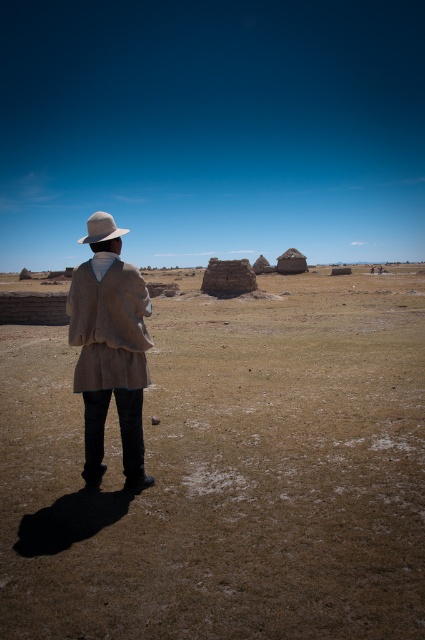
You are a photographer trying to capture the beige woolen poncho at center and the light beige felt fedora at back in a single frame. Based on their positions, which object should you focus on first to ensure both are in the shot?

The beige woolen poncho at center is positioned under the light beige felt fedora at back, so you should focus on the light beige felt fedora at back first to ensure both are in the shot.

You are navigating a drone over the landscape and need to drop a package at the point closest to the viewer. Which point should you choose between point (139, 387) and point (112, 228)?

A: Point (139, 387) is closer to the viewer than point (112, 228), so you should drop the package at point (139, 387).

You are a drone operator trying to map the terrain. You need to locate the brown grassland at center in the image. What are its coordinates?

The brown grassland at center is located at coordinates point [227,472].